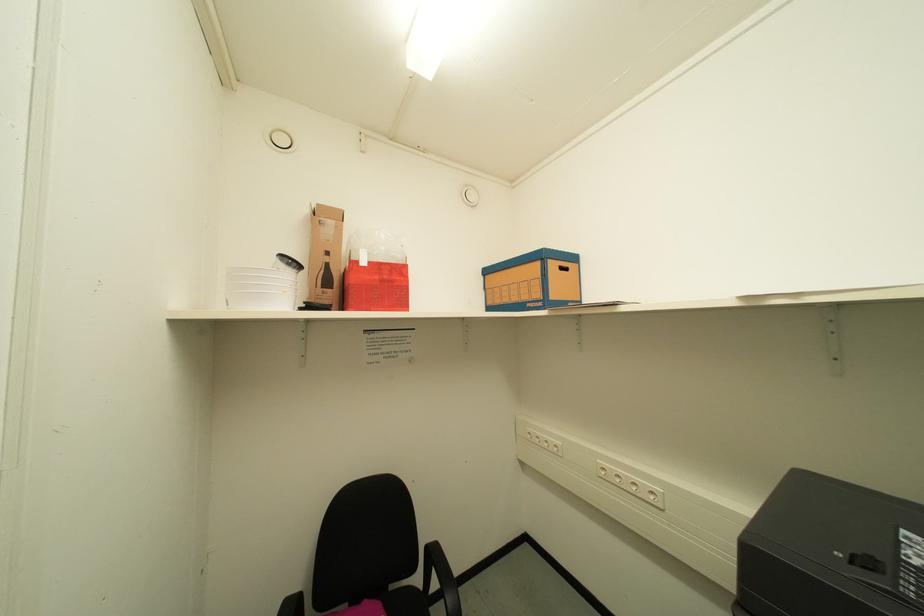
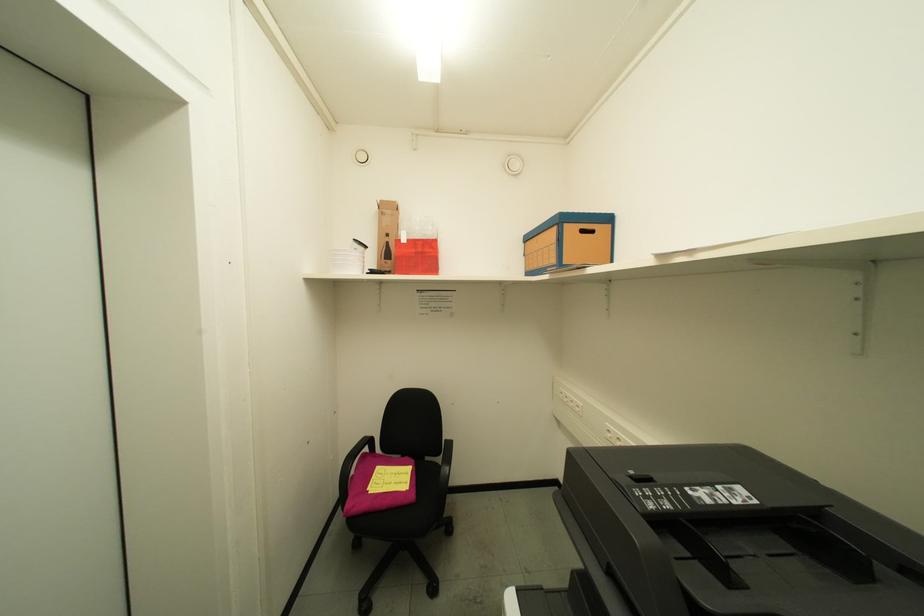
Question: What movement of the cameraman would produce the second image?

Choices:
 (A) Left
 (B) Right
 (C) Forward
 (D) Backward

Answer: (B)